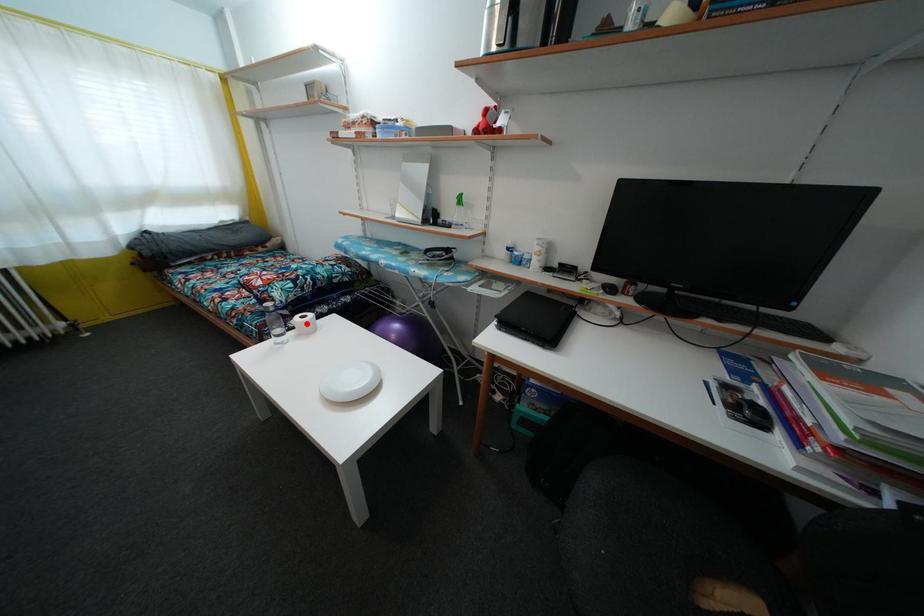
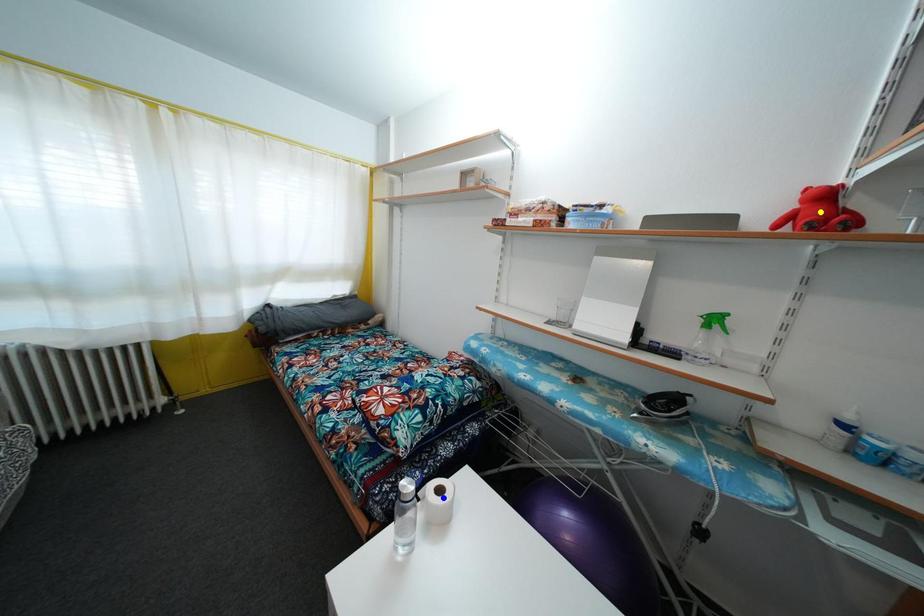
Question: I am providing you with two images of the same scene from different viewpoints. A red point is marked on the first image. You are given multiple points on the second image. Which mark in image 2 goes with the point in image 1?

Choices:
 (A) yellow point
 (B) blue point
 (C) green point

Answer: (B)